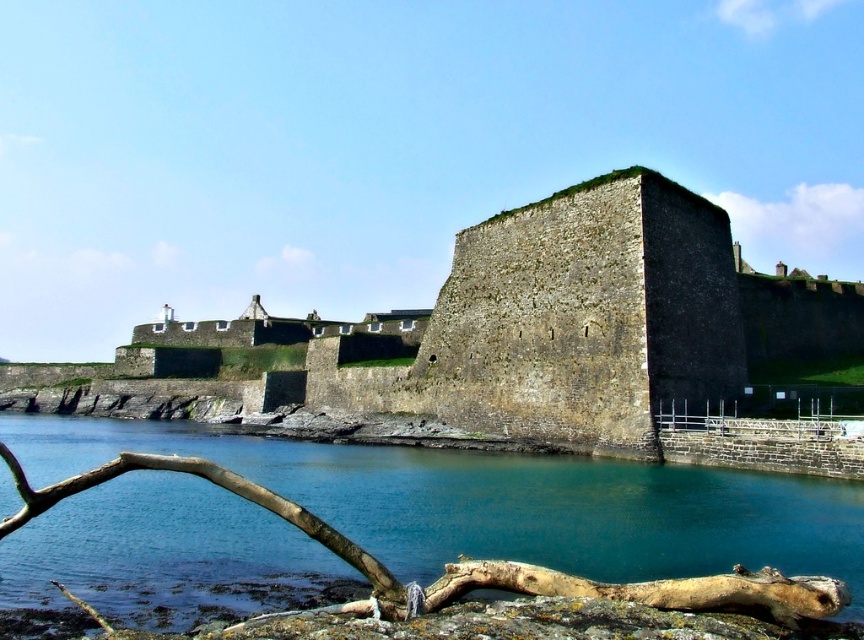
Consider the image. You are a sailor approaching the fortress by boat. You see the brown stone wall at center and the blue water at lower left. Which object is closer to your boat as you arrive at the harbor?

The brown stone wall at center is closer to your boat because the blue water at lower left is behind it, meaning the wall is in front of the water.

You are a tourist standing at the edge of the fortress and want to take a photo of the brown stone wall at center and the blue water at lower left. If you want to include both in your frame, which object should you focus on to ensure both are visible?

You should focus on the brown stone wall at center because it might be wider than the blue water at lower left, so positioning the camera to include its broader width would naturally encompass the narrower blue water at lower left as well.